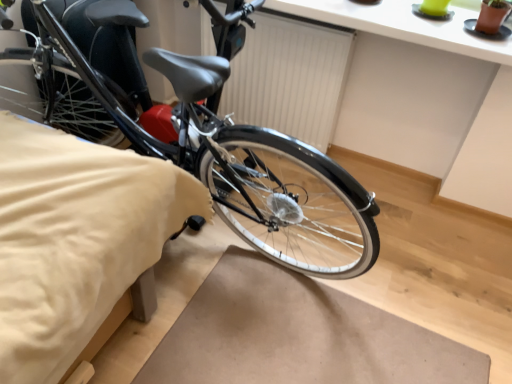
Question: Is white matte radiator at center in front of or behind shiny black bicycle at left in the image?

Choices:
 (A) front
 (B) behind

Answer: (B)

Question: Is white matte radiator at center taller or shorter than shiny black bicycle at left?

Choices:
 (A) tall
 (B) short

Answer: (B)

Question: Based on their relative distances, which object is nearer to the beige fabric bedsheet at lower left?

Choices:
 (A) white matte radiator at center
 (B) shiny black bicycle at left

Answer: (B)

Question: Based on their relative distances, which object is farther from the beige fabric bedsheet at lower left?

Choices:
 (A) shiny black bicycle at left
 (B) white matte radiator at center

Answer: (B)